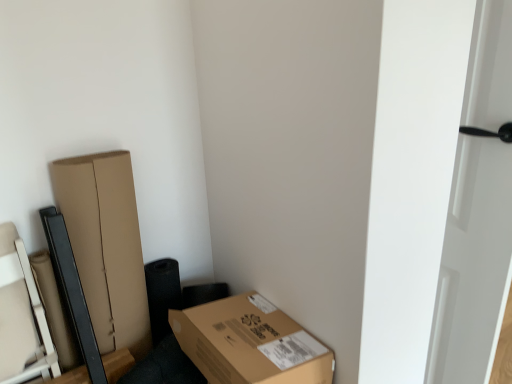
Image resolution: width=512 pixels, height=384 pixels. What do you see at coordinates (473, 264) in the screenshot?
I see `white glossy door at right` at bounding box center [473, 264].

I want to click on white glossy door at right, so click(x=473, y=264).

The image size is (512, 384). I want to click on brown cardboard box at lower right, so click(250, 343).

What is the approximate width of brown cardboard box at lower right?

It is 46.19 centimeters.

The image size is (512, 384). Describe the element at coordinates (250, 343) in the screenshot. I see `brown cardboard box at lower right` at that location.

The width and height of the screenshot is (512, 384). In order to click on white glossy door at right in this screenshot , I will do `click(473, 264)`.

Between white glossy door at right and brown cardboard box at lower right, which one appears on the left side from the viewer's perspective?

From the viewer's perspective, brown cardboard box at lower right appears more on the left side.

In the scene shown: Considering the positions of objects white glossy door at right and brown cardboard box at lower right in the image provided, who is in front, white glossy door at right or brown cardboard box at lower right?

white glossy door at right.

Is point (497, 260) closer to viewer compared to point (288, 339)?

No, (497, 260) is further to viewer.

Based on the photo, from the image's perspective, is white glossy door at right on brown cardboard box at lower right?

Yes.

From a real-world perspective, is white glossy door at right on top of brown cardboard box at lower right?

Yes, from a real-world perspective, white glossy door at right is above brown cardboard box at lower right.

Is white glossy door at right wider than brown cardboard box at lower right?

No, white glossy door at right is not wider than brown cardboard box at lower right.

From the picture: Is white glossy door at right shorter than brown cardboard box at lower right?

Incorrect, the height of white glossy door at right does not fall short of that of brown cardboard box at lower right.

Considering the sizes of objects white glossy door at right and brown cardboard box at lower right in the image provided, who is bigger, white glossy door at right or brown cardboard box at lower right?

With larger size is brown cardboard box at lower right.

Choose the correct answer: Is white glossy door at right inside brown cardboard box at lower right or outside it?

white glossy door at right cannot be found inside brown cardboard box at lower right.

Is white glossy door at right not near brown cardboard box at lower right?

white glossy door at right is actually quite close to brown cardboard box at lower right.

Does white glossy door at right turn towards brown cardboard box at lower right?

No, white glossy door at right is not oriented towards brown cardboard box at lower right.

What's the angular difference between white glossy door at right and brown cardboard box at lower right's facing directions?

95.8 degrees separate the facing orientations of white glossy door at right and brown cardboard box at lower right.

Identify the location of box that appears below the white glossy door at right (from the image's perspective). (250, 343).

Between brown cardboard box at lower right and white glossy door at right, which one appears on the left side from the viewer's perspective?

Positioned to the left is brown cardboard box at lower right.

Considering the relative positions of brown cardboard box at lower right and white glossy door at right in the image provided, is brown cardboard box at lower right in front of white glossy door at right?

No, brown cardboard box at lower right is behind white glossy door at right.

Is point (328, 357) behind point (458, 217)?

No, it is not.

From the image's perspective, is brown cardboard box at lower right positioned above or below white glossy door at right?

brown cardboard box at lower right is situated lower than white glossy door at right in the image.

From a real-world perspective, is brown cardboard box at lower right above or below white glossy door at right?

brown cardboard box at lower right is situated lower than white glossy door at right in the real world.

Can you confirm if brown cardboard box at lower right is thinner than white glossy door at right?

Incorrect, the width of brown cardboard box at lower right is not less than that of white glossy door at right.

Looking at this image, who is taller, brown cardboard box at lower right or white glossy door at right?

white glossy door at right is taller.

Is brown cardboard box at lower right bigger than white glossy door at right?

Yes.

Would you say white glossy door at right is part of brown cardboard box at lower right's contents?

No, white glossy door at right is not a part of brown cardboard box at lower right.

Does brown cardboard box at lower right touch white glossy door at right?

No, brown cardboard box at lower right is not next to white glossy door at right.

Is brown cardboard box at lower right positioned with its back to white glossy door at right?

No.

How many degrees apart are the facing directions of brown cardboard box at lower right and white glossy door at right?

They differ by 95.8 degrees in their facing directions.

Measure the distance between brown cardboard box at lower right and white glossy door at right.

A distance of 23.37 inches exists between brown cardboard box at lower right and white glossy door at right.

Locate an element on the screen. The height and width of the screenshot is (384, 512). box on the left of white glossy door at right is located at coordinates (250, 343).

Locate an element on the screen. This screenshot has width=512, height=384. door in front of the brown cardboard box at lower right is located at coordinates (473, 264).

Where is `box behind the white glossy door at right`? This screenshot has height=384, width=512. box behind the white glossy door at right is located at coordinates (250, 343).